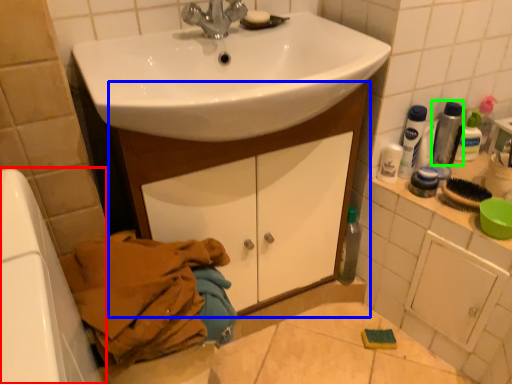
Question: Which object is the farthest from bath (highlighted by a red box)? Choose among these: bathroom cabinet (highlighted by a blue box) or mouthwash (highlighted by a green box).

Choices:
 (A) bathroom cabinet
 (B) mouthwash

Answer: (B)